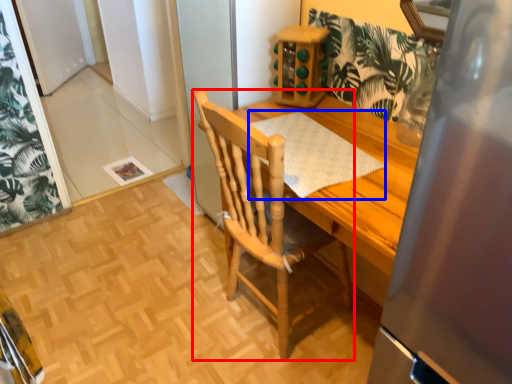
Question: Which object appears farthest to the camera in this image, chair (highlighted by a red box) or place mat (highlighted by a blue box)?

Choices:
 (A) chair
 (B) place mat

Answer: (B)